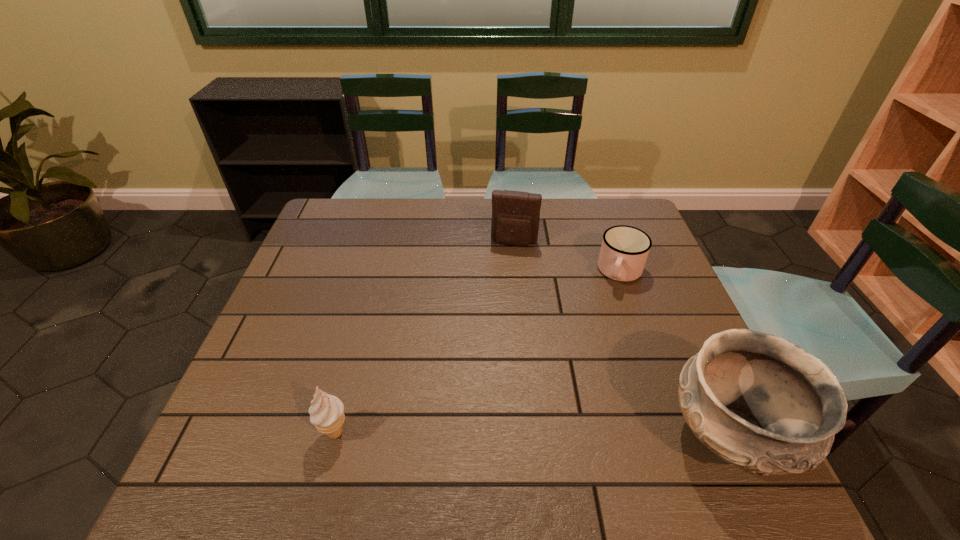
This screenshot has width=960, height=540. Identify the location of vacant spot on the desktop that is between the icecream and the pottery and is positioned with an open flap on the second object from left to right. (482, 434).

Locate an element on the screen. The height and width of the screenshot is (540, 960). free spot on the desktop that is between the leftmost object and the pottery and is positioned on the side of the mug with the handle is located at coordinates (560, 434).